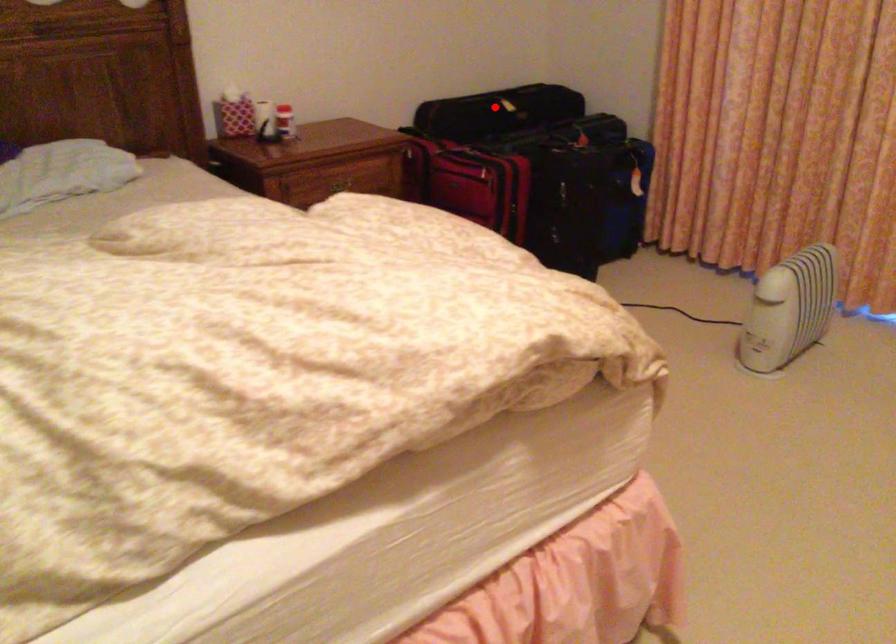
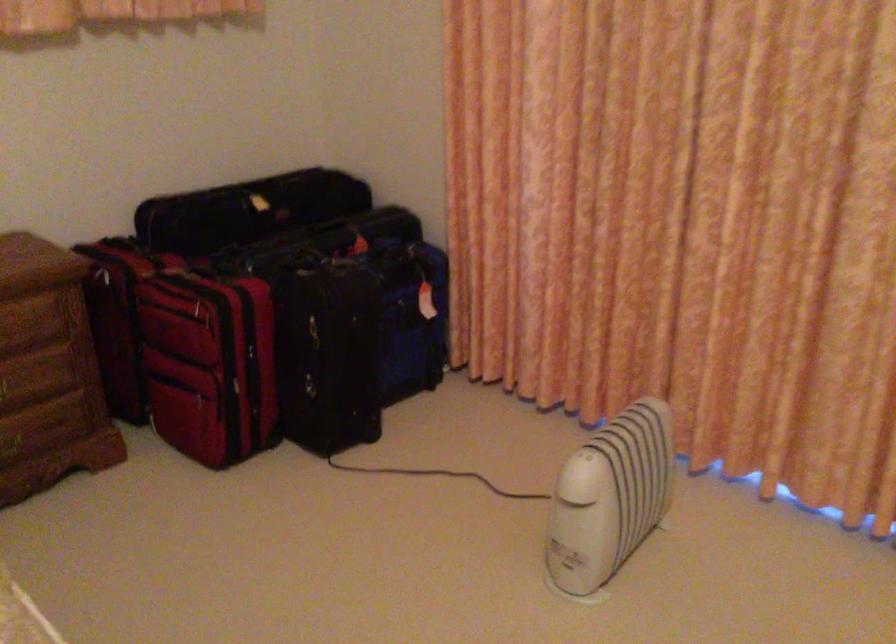
Question: A red point is marked in image1. In image2, is the corresponding 3D point closer to the camera or farther? Reply with the corresponding letter.

Choices:
 (A) The corresponding 3D point is closer.
 (B) The corresponding 3D point is farther.

Answer: (A)